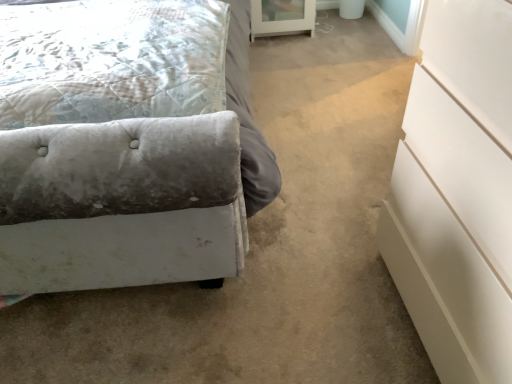
Question: Are white glass cabinet at upper center and white glossy chest of drawers at right making contact?

Choices:
 (A) no
 (B) yes

Answer: (A)

Question: Considering the relative sizes of white glass cabinet at upper center and white glossy chest of drawers at right in the image provided, is white glass cabinet at upper center wider than white glossy chest of drawers at right?

Choices:
 (A) no
 (B) yes

Answer: (A)

Question: From a real-world perspective, is white glass cabinet at upper center physically below white glossy chest of drawers at right?

Choices:
 (A) yes
 (B) no

Answer: (A)

Question: Does white glass cabinet at upper center have a larger size compared to white glossy chest of drawers at right?

Choices:
 (A) yes
 (B) no

Answer: (B)

Question: Is white glass cabinet at upper center to the right of white glossy chest of drawers at right from the viewer's perspective?

Choices:
 (A) no
 (B) yes

Answer: (A)

Question: Relative to white glossy chest of drawers at right, is velvet tufted pillow at left in front or behind?

Choices:
 (A) front
 (B) behind

Answer: (B)

Question: In terms of width, does velvet tufted pillow at left look wider or thinner when compared to white glossy chest of drawers at right?

Choices:
 (A) thin
 (B) wide

Answer: (B)

Question: Is velvet tufted pillow at left taller or shorter than white glossy chest of drawers at right?

Choices:
 (A) tall
 (B) short

Answer: (B)

Question: Is velvet tufted pillow at left bigger or smaller than white glossy chest of drawers at right?

Choices:
 (A) big
 (B) small

Answer: (B)

Question: Is white glossy chest of drawers at right taller or shorter than velvet gray bed at lower left?

Choices:
 (A) tall
 (B) short

Answer: (B)

Question: In terms of width, does white glossy chest of drawers at right look wider or thinner when compared to velvet gray bed at lower left?

Choices:
 (A) wide
 (B) thin

Answer: (B)

Question: From the image's perspective, is white glossy chest of drawers at right positioned above or below velvet gray bed at lower left?

Choices:
 (A) above
 (B) below

Answer: (B)

Question: Would you say white glossy chest of drawers at right is inside or outside velvet gray bed at lower left?

Choices:
 (A) inside
 (B) outside

Answer: (B)

Question: Is white glossy chest of drawers at right taller or shorter than white glass cabinet at upper center?

Choices:
 (A) short
 (B) tall

Answer: (B)

Question: Is white glossy chest of drawers at right inside or outside of white glass cabinet at upper center?

Choices:
 (A) inside
 (B) outside

Answer: (B)